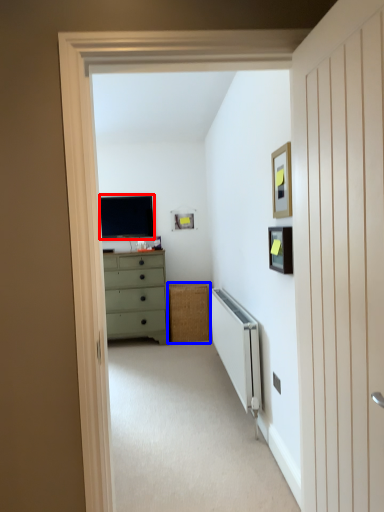
Question: Which object is further to the camera taking this photo, television (highlighted by a red box) or cabinetry (highlighted by a blue box)?

Choices:
 (A) television
 (B) cabinetry

Answer: (A)